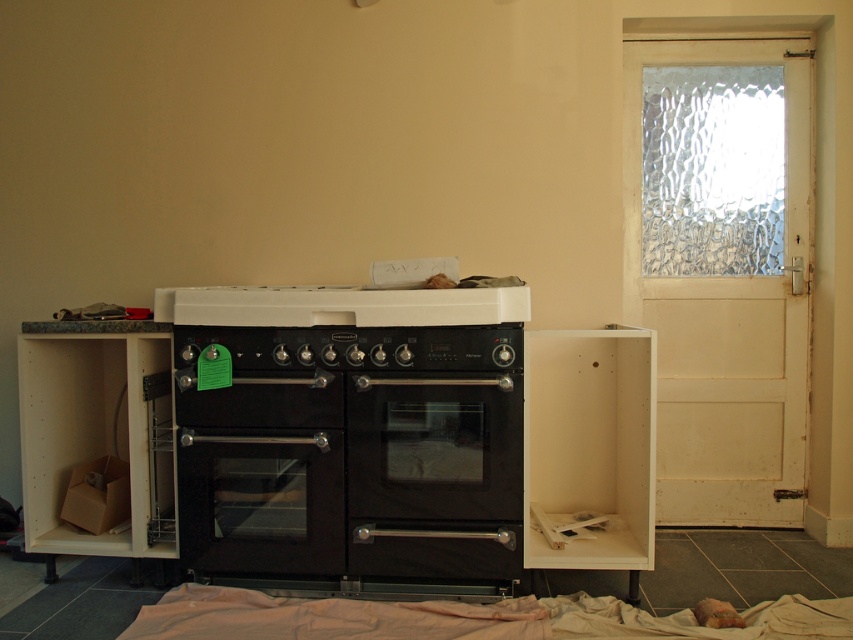
Between black matte oven at center and black matte stove at center, which one is positioned lower?

Positioned lower is black matte oven at center.

This screenshot has width=853, height=640. Describe the element at coordinates (350, 438) in the screenshot. I see `black matte oven at center` at that location.

Is point (303, 365) farther from camera compared to point (430, 308)?

That is True.

Where is `black matte oven at center`? The height and width of the screenshot is (640, 853). black matte oven at center is located at coordinates (350, 438).